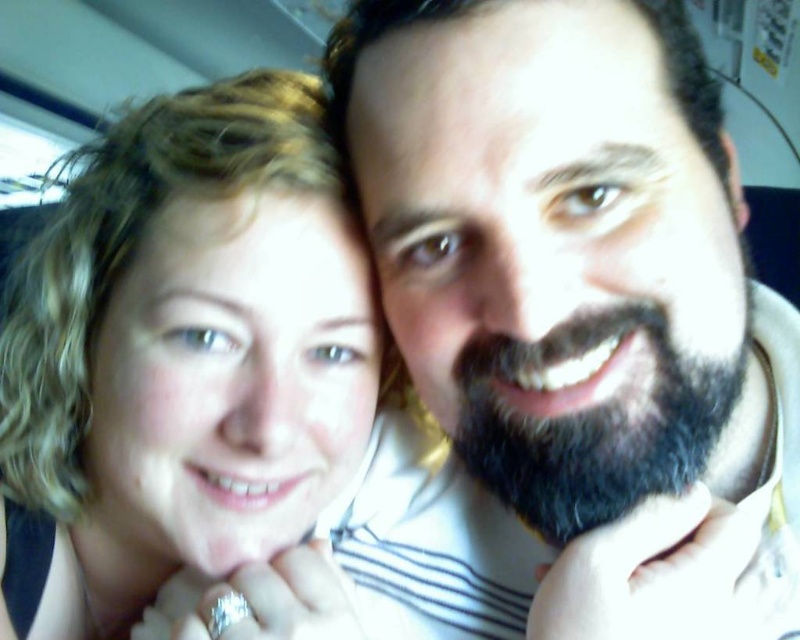
Question: Which point appears closest to the camera in this image?

Choices:
 (A) (102, 243)
 (B) (592, 500)

Answer: (B)

Question: Which point is closer to the camera taking this photo?

Choices:
 (A) (568, 490)
 (B) (76, 225)

Answer: (A)

Question: Is blonde hair at left positioned at the back of dark brown fuzzy beard at center?

Choices:
 (A) yes
 (B) no

Answer: (A)

Question: Does blonde hair at left appear under dark brown fuzzy beard at center?

Choices:
 (A) no
 (B) yes

Answer: (A)

Question: Is blonde hair at left above dark brown fuzzy beard at center?

Choices:
 (A) yes
 (B) no

Answer: (A)